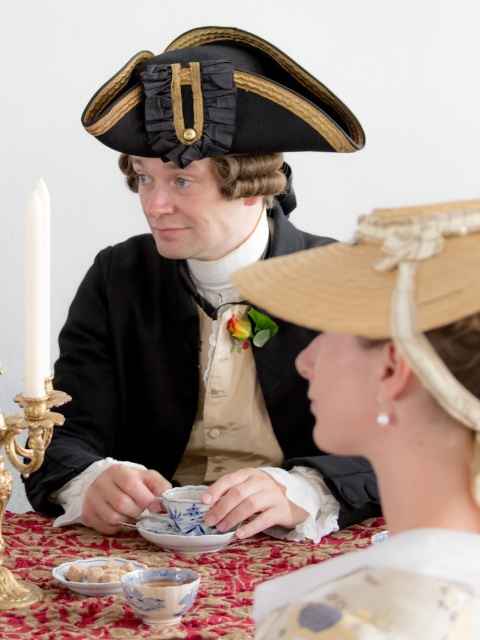
You are an interior designer tasked with arranging items in a display case. You have a natural straw hat at center and a gold ornate candlestick at left. Which item takes up more space in the display case?

The gold ornate candlestick at left takes up more space in the display case than the natural straw hat at center because the natural straw hat at center occupies less space than gold ornate candlestick at left.

You are a guest at this historical event and want to place a napkin on the table. Considering the porcelain plate at center and the white glossy dumplings at lower left, which object should you place the napkin under to ensure it stays in place?

The porcelain plate at center is taller than the white glossy dumplings at lower left, so placing the napkin under the porcelain plate at center would provide better support and stability.

You are standing at the origin point in the image and need to reach a hidden treasure located at point [44,344]. There is an obstacle at point [326,268]. Can you safely navigate around the obstacle to reach the treasure without getting too close?

Point [326,268] is in front of point [44,344], so you can navigate around the obstacle by moving around it since it is blocking your path.